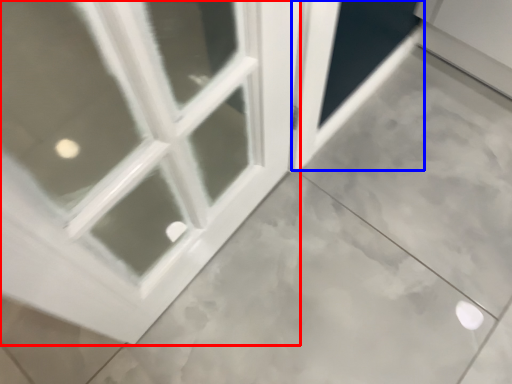
Question: Which of the following is the farthest to the observer, window (highlighted by a red box) or screen door (highlighted by a blue box)?

Choices:
 (A) window
 (B) screen door

Answer: (B)